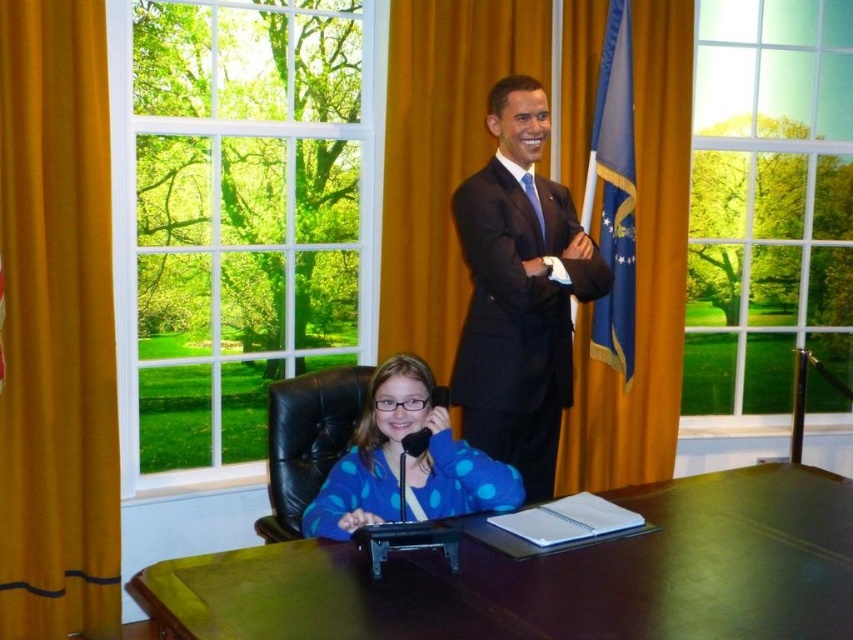
Which is above, black suit at center or blue polka dot sweater at center?

black suit at center is higher up.

Does black suit at center have a lesser width compared to blue polka dot sweater at center?

Indeed, black suit at center has a lesser width compared to blue polka dot sweater at center.

I want to click on black suit at center, so click(519, 292).

Is orange velvet curtain at center further to camera compared to blue silk tie at upper center?

Yes, orange velvet curtain at center is further from the viewer.

Who is more distant from viewer, (431, 300) or (520, 182)?

Positioned behind is point (431, 300).

The width and height of the screenshot is (853, 640). I want to click on orange velvet curtain at center, so click(462, 141).

In the scene shown: Is orange fabric curtain at left shorter than black suit at center?

No, orange fabric curtain at left is not shorter than black suit at center.

Is point (33, 614) positioned in front of point (496, 413)?

No, (33, 614) is further to viewer.

I want to click on orange fabric curtain at left, so click(x=57, y=326).